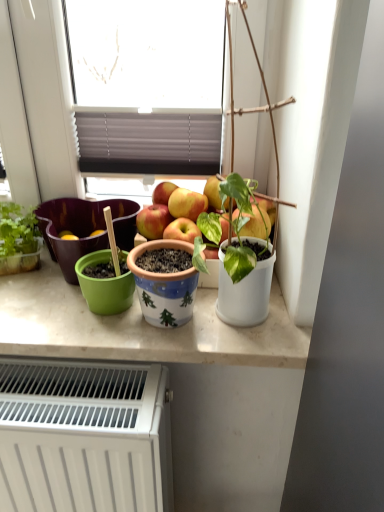
This screenshot has width=384, height=512. I want to click on vacant space that is to the left of blue ceramic pot at center, the 2th flowerpot when ordered from back to front, so click(68, 325).